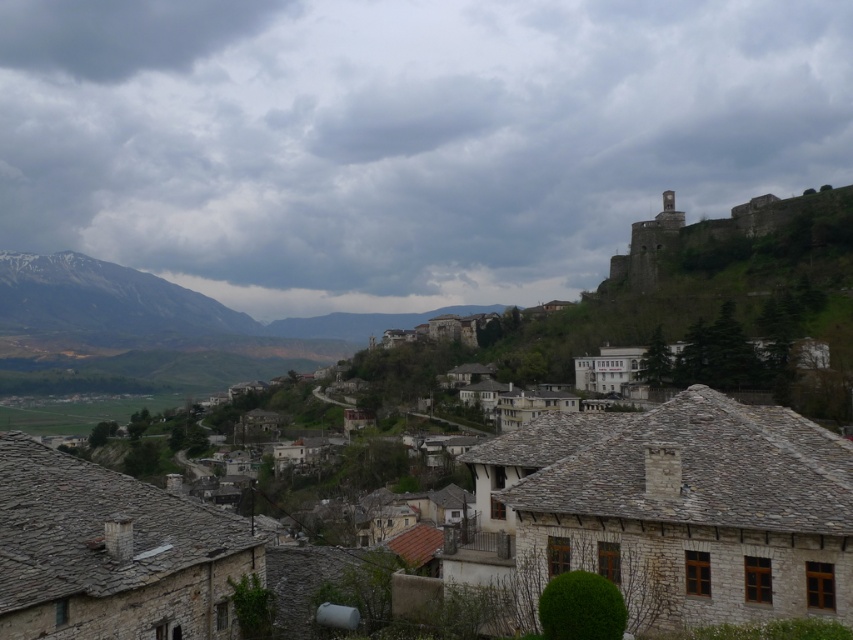
Question: Which object is positioned farthest from the cloudy sky at upper center?

Choices:
 (A) dark gray cloud at upper left
 (B) stone village at center

Answer: (B)

Question: Is cloudy sky at upper center closer to the viewer compared to dark gray cloud at upper left?

Choices:
 (A) no
 (B) yes

Answer: (B)

Question: Which point is farther from the camera taking this photo?

Choices:
 (A) (706, 524)
 (B) (141, 13)

Answer: (B)

Question: Is cloudy sky at upper center bigger than dark gray cloud at upper left?

Choices:
 (A) yes
 (B) no

Answer: (A)

Question: Estimate the real-world distances between objects in this image. Which object is farther from the cloudy sky at upper center?

Choices:
 (A) stone village at center
 (B) dark gray cloud at upper left

Answer: (A)

Question: Does stone village at center have a larger size compared to dark gray cloud at upper left?

Choices:
 (A) yes
 (B) no

Answer: (B)